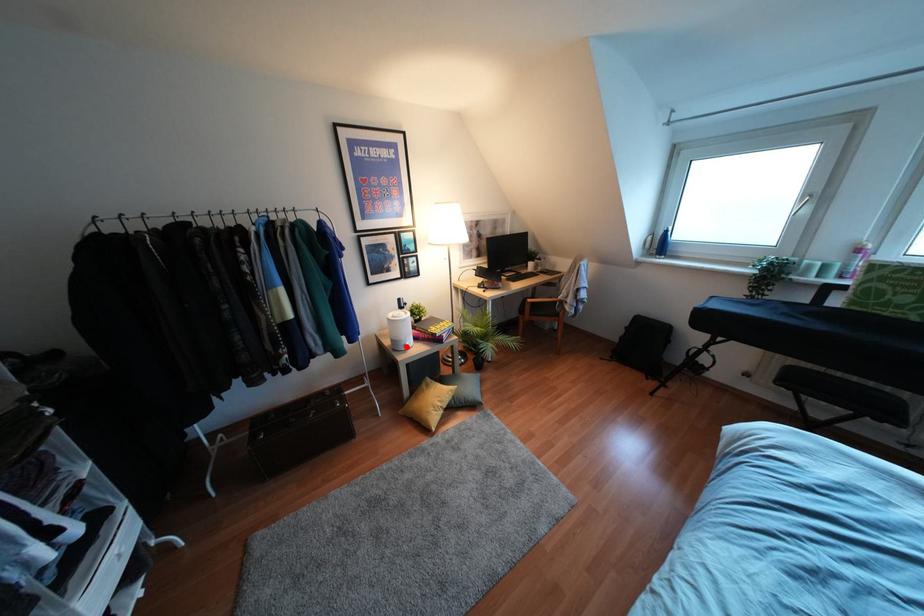
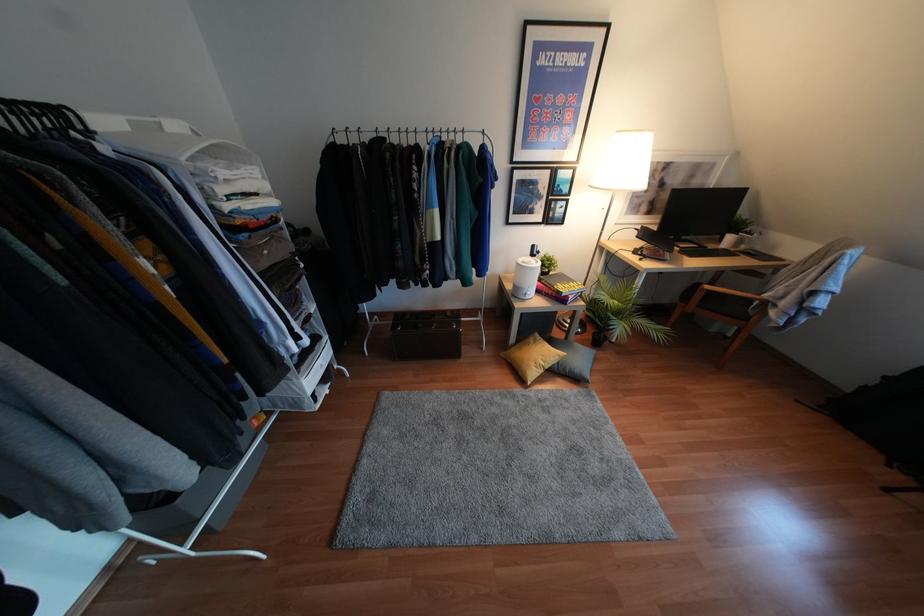
The point at the highlighted location is marked in the first image. Where is the corresponding point in the second image?

(526, 297)